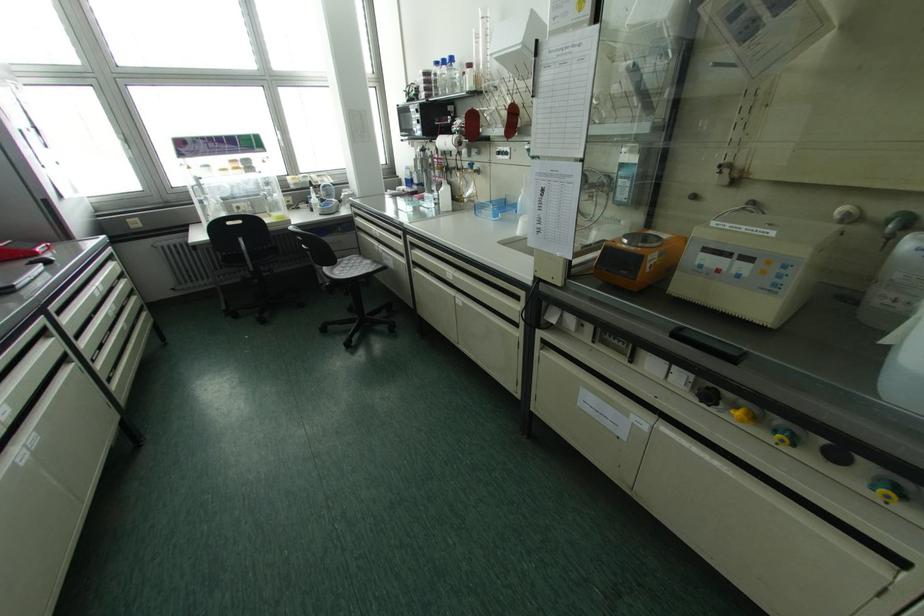
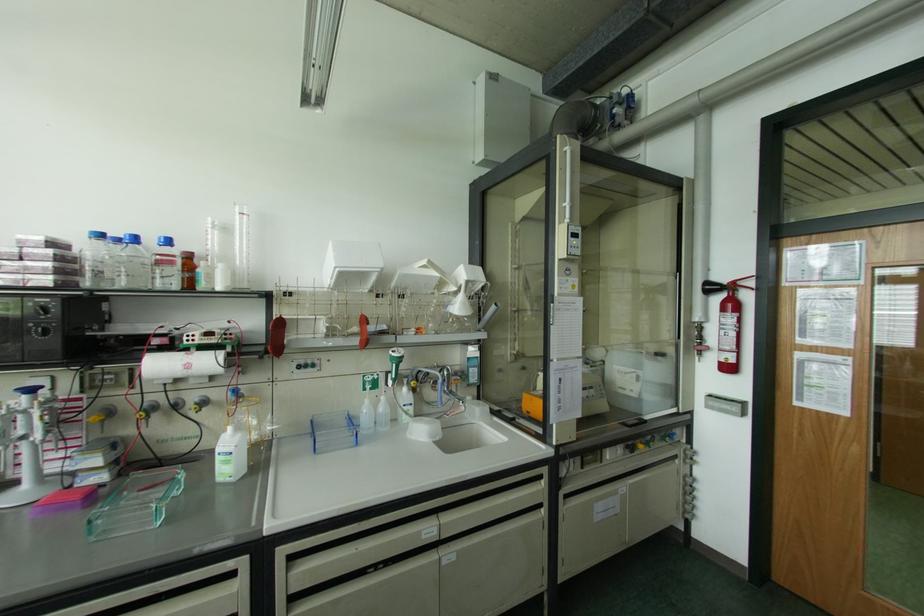
Find the pixel in the second image that matches point (443, 62) in the first image.

(134, 238)